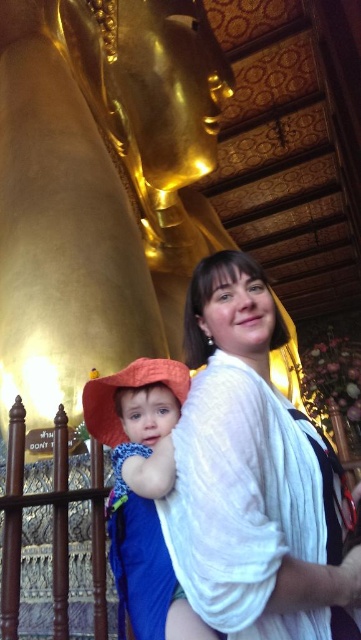
Question: Where is white sheer fabric at center located in relation to orange fabric hat at left in the image?

Choices:
 (A) below
 (B) above

Answer: (B)

Question: Considering the real-world distances, which object is closest to the orange fabric hat at lower left?

Choices:
 (A) blue cotton robe at lower left
 (B) orange fabric hat at left
 (C) white sheer fabric at center

Answer: (B)

Question: Which object is positioned closest to the white sheer fabric at center?

Choices:
 (A) orange fabric hat at lower left
 (B) blue cotton robe at lower left

Answer: (B)

Question: From the image, what is the correct spatial relationship of orange fabric hat at left in relation to blue cotton robe at lower left?

Choices:
 (A) left
 (B) right

Answer: (B)

Question: Which point is closer to the camera taking this photo?

Choices:
 (A) (135, 625)
 (B) (175, 387)
 (C) (233, 266)

Answer: (A)

Question: Does orange fabric hat at left lie behind blue cotton robe at lower left?

Choices:
 (A) no
 (B) yes

Answer: (A)